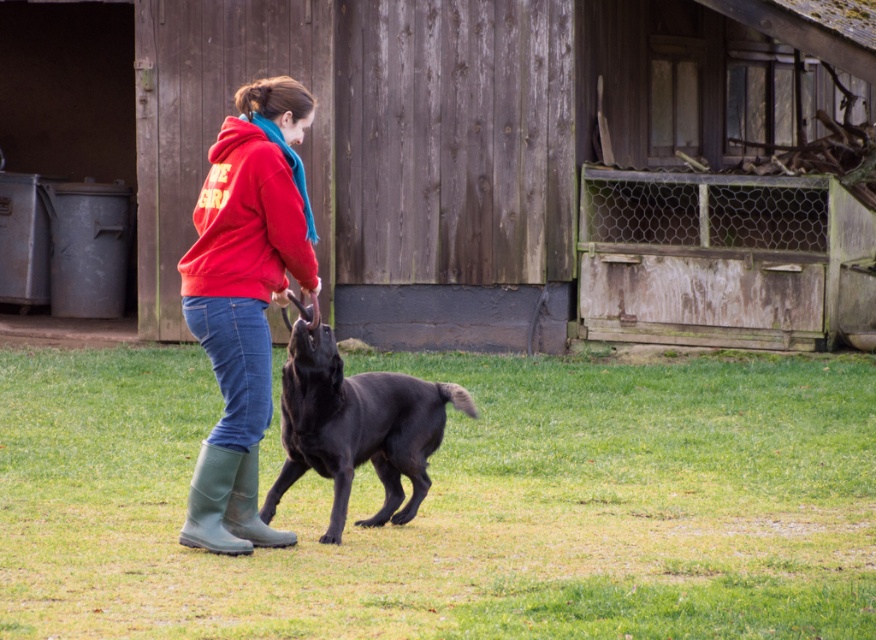
You are standing in the middle of the grassy area and see the weathered wood barn at center and the red fleece sweatshirt at center. Which object is closer to your right side?

The red fleece sweatshirt at center is to the right of the weathered wood barn at center, so it is closer to your right side.

You are standing in the outdoor scene and want to place a small flag at the closest point between point (x=232, y=166) and point (x=256, y=538). Which point should you choose?

Point (x=232, y=166) is closer to the camera than point (x=256, y=538), so you should place the flag at point (x=232, y=166).